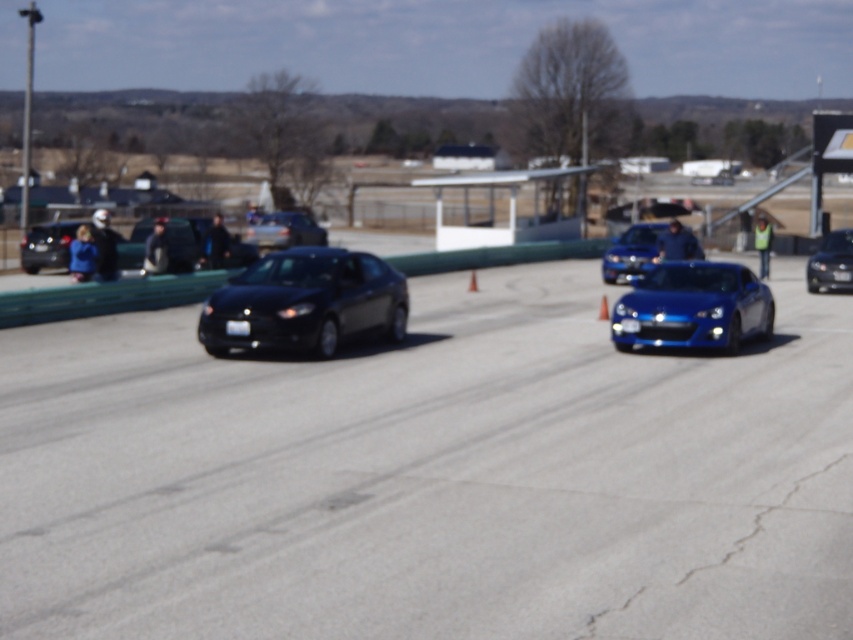
Question: Which point is farther from the camera taking this photo?

Choices:
 (A) (44, 576)
 (B) (817, 266)
 (C) (387, 310)
 (D) (286, 243)

Answer: (D)

Question: Is smooth asphalt road at center positioned in front of satin black sedan at center?

Choices:
 (A) yes
 (B) no

Answer: (A)

Question: Can you confirm if matte black sedan at center is positioned to the right of satin black sedan at center?

Choices:
 (A) yes
 (B) no

Answer: (A)

Question: Can you confirm if matte black sedan at left is wider than shiny black car at right?

Choices:
 (A) no
 (B) yes

Answer: (B)

Question: Which point is farther to the camera?

Choices:
 (A) (248, 227)
 (B) (808, 307)

Answer: (A)

Question: Considering the real-world distances, which object is closest to the glossy blue sports car at center?

Choices:
 (A) matte black sedan at left
 (B) smooth asphalt road at center
 (C) shiny metallic sports car at right
 (D) satin black sedan at center

Answer: (C)